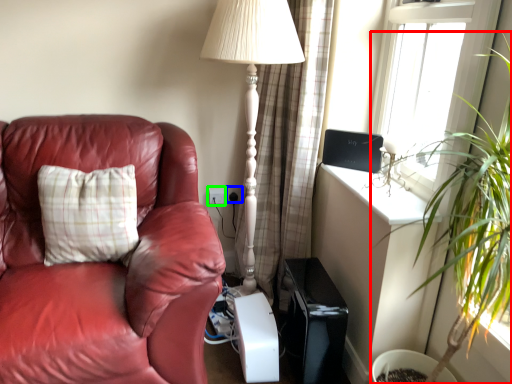
Question: Which object is the farthest from houseplant (highlighted by a red box)? Choose among these: electric outlet (highlighted by a blue box) or electric outlet (highlighted by a green box).

Choices:
 (A) electric outlet
 (B) electric outlet

Answer: (B)